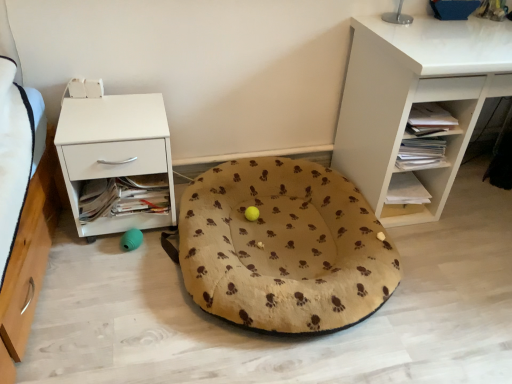
Locate an element on the screen. free spot in front of white matte desk at upper right, the 2th shelf when ordered from bottom to top is located at coordinates (455, 283).